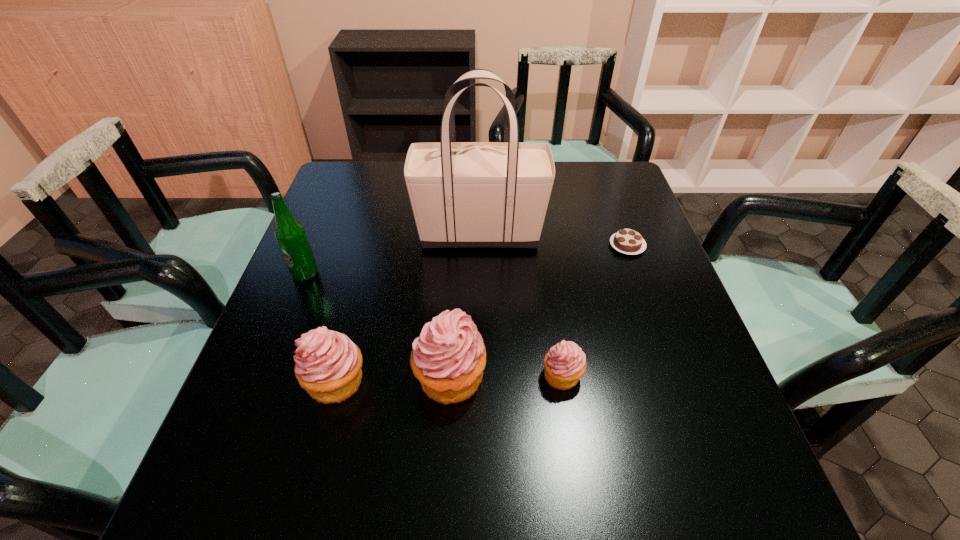
Please point a free position for a cupcake on the right. Please provide its 2D coordinates. Your answer should be formatted as a tuple, i.e. [(x, y)], where the tuple contains the x and y coordinates of a point satisfying the conditions above.

[(674, 372)]